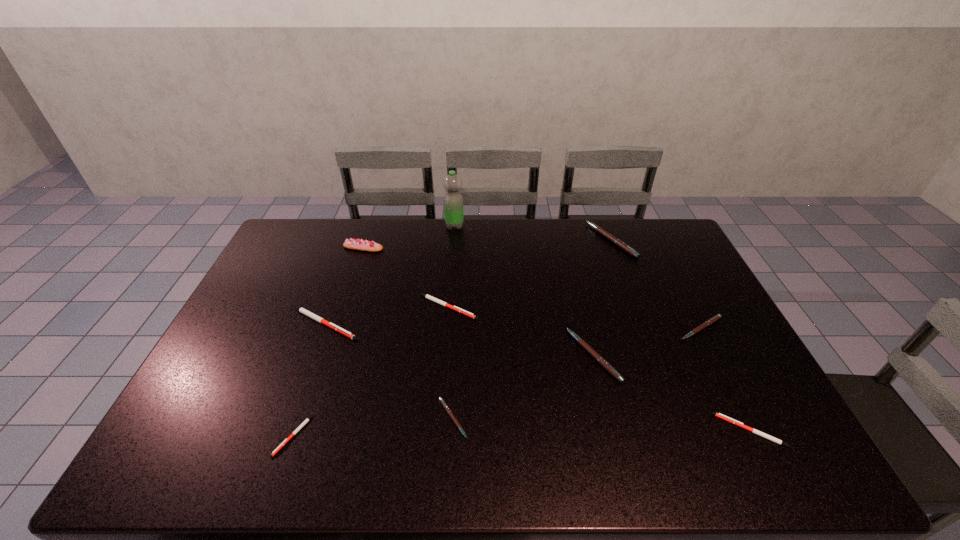
I want to click on vacant area between the shortest pen and the fourth object from right to left, so click(444, 396).

At what (x,y) coordinates should I click in order to perform the action: click on blank region between the third biggest pink pen and the tallest object. Please return your answer as a coordinate pair (x, y). Looking at the image, I should click on [x=578, y=277].

Image resolution: width=960 pixels, height=540 pixels. I want to click on unoccupied area between the third smallest white pen and the rightmost pink pen, so coord(574,318).

Image resolution: width=960 pixels, height=540 pixels. What are the coordinates of `free point between the shortest object and the eclair` in the screenshot? It's located at (328, 342).

Locate an element on the screen. unoccupied area between the leftmost pink pen and the farthest pen is located at coordinates click(x=532, y=329).

Find the location of a particular element. unoccupied area between the biggest white pen and the leftmost pink pen is located at coordinates (388, 371).

Identify the location of vacant point located between the second biggest white pen and the sixth pen from left to right. This screenshot has height=540, width=960. (529, 274).

This screenshot has height=540, width=960. I want to click on free space between the rightmost white pen and the second pink pen from left to right, so click(x=672, y=393).

The width and height of the screenshot is (960, 540). Identify the location of vacant space in between the leftmost pink pen and the biggest pink pen. coord(532,329).

Identify the location of vacant region between the biggest white pen and the shortest pen. (308, 380).